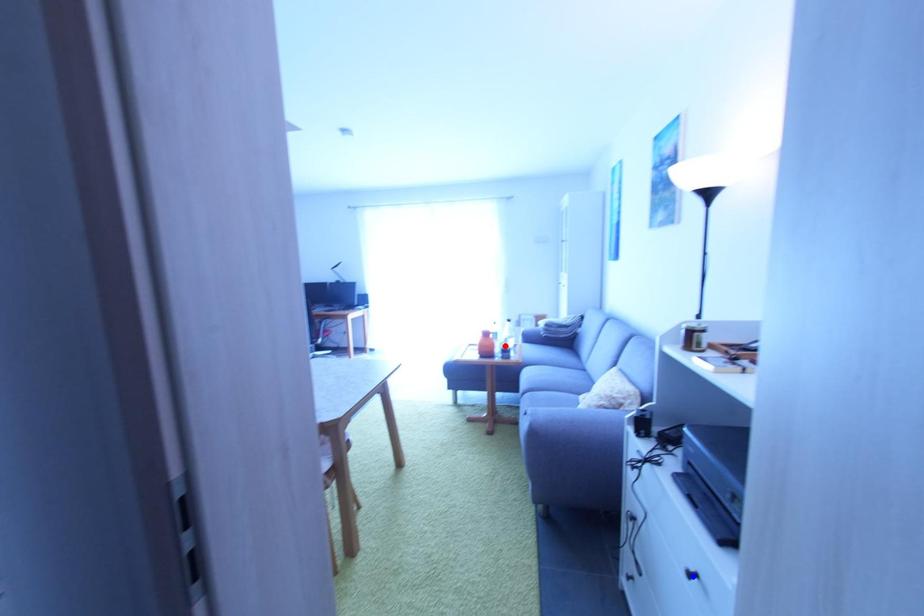
Question: Two points are marked on the image. Which point is closer to the camera?

Choices:
 (A) Blue point is closer.
 (B) Red point is closer.

Answer: (A)